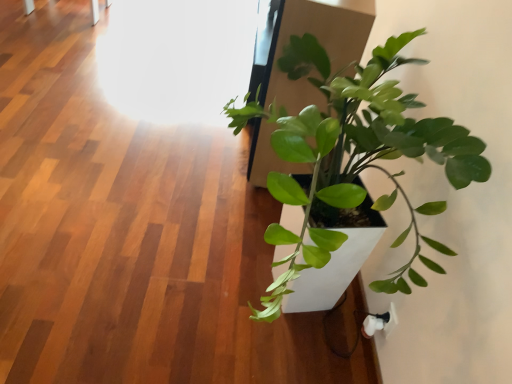
This screenshot has height=384, width=512. Describe the element at coordinates (355, 154) in the screenshot. I see `green matte plant at right` at that location.

In order to face green matte plant at right, should I rotate leftwards or rightwards?

You should look right and rotate roughly 7.162 degrees.

Locate an element on the screen. This screenshot has width=512, height=384. green matte plant at right is located at coordinates (355, 154).

Where is `green matte plant at right`? The image size is (512, 384). green matte plant at right is located at coordinates (355, 154).